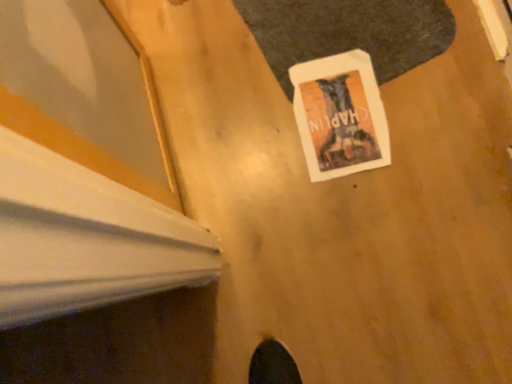
Locate an element on the screen. free space to the back side of white paper at center is located at coordinates (300, 36).